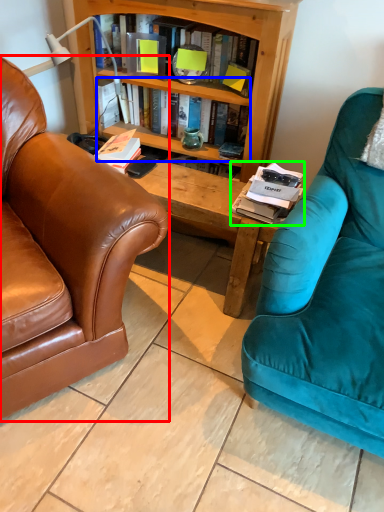
Question: Considering the real-world distances, which object is closest to chair (highlighted by a red box)? book (highlighted by a blue box) or magazine (highlighted by a green box).

Choices:
 (A) book
 (B) magazine

Answer: (B)